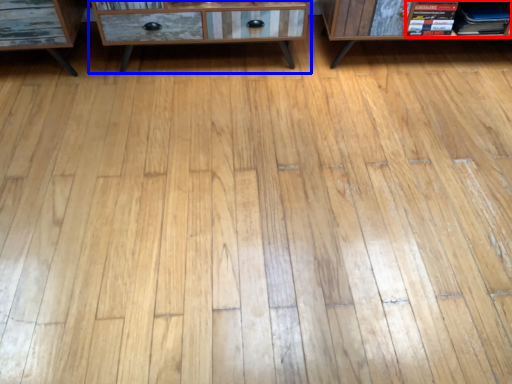
Question: Among these objects, which one is farthest to the camera, book (highlighted by a red box) or chest of drawers (highlighted by a blue box)?

Choices:
 (A) book
 (B) chest of drawers

Answer: (A)